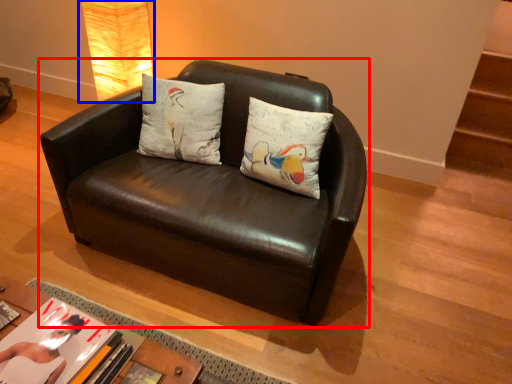
Question: Which object is closer to the camera taking this photo, studio couch (highlighted by a red box) or lamp (highlighted by a blue box)?

Choices:
 (A) studio couch
 (B) lamp

Answer: (A)